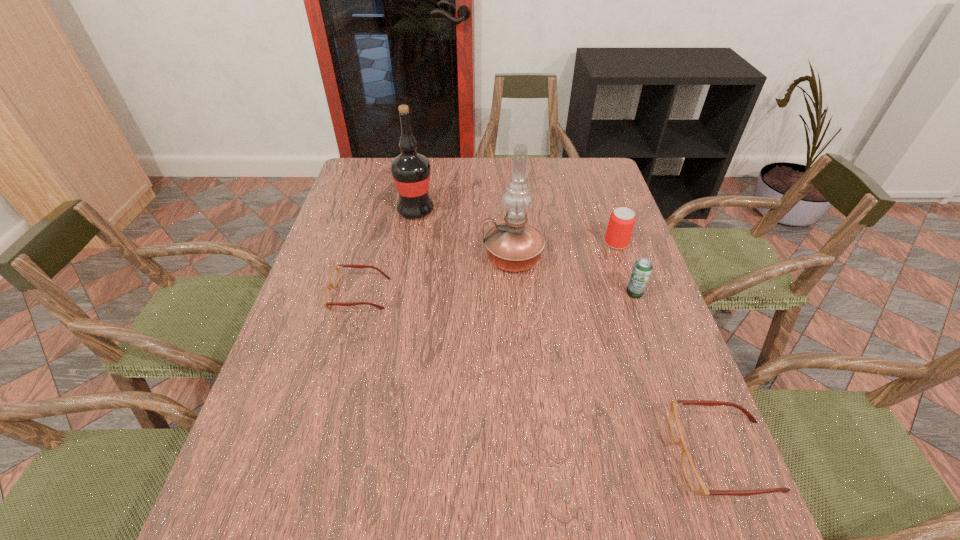
Locate an element on the screen. the left spectacles is located at coordinates (334, 276).

At what (x,y) coordinates should I click in order to perform the action: click on the shortest object. Please return your answer as a coordinate pair (x, y). This screenshot has height=540, width=960. Looking at the image, I should click on (334, 276).

The image size is (960, 540). I want to click on the taller spectacles, so click(694, 480).

This screenshot has width=960, height=540. I want to click on the nearest object, so click(694, 480).

At what (x,y) coordinates should I click in order to perform the action: click on wine bottle. Please return your answer as a coordinate pair (x, y). Image resolution: width=960 pixels, height=540 pixels. Looking at the image, I should click on (411, 170).

Where is `the nearer beer can`? This screenshot has width=960, height=540. the nearer beer can is located at coordinates (642, 269).

You are a GUI agent. You are given a task and a screenshot of the screen. Output one action in this format:
    pyautogui.click(x=<x>, y=<y>)
    Task: Click on the oil lamp
    The height and width of the screenshot is (540, 960).
    Given the screenshot: What is the action you would take?
    pyautogui.click(x=514, y=246)

Image resolution: width=960 pixels, height=540 pixels. Find the location of `the farther beer can`. the farther beer can is located at coordinates (622, 220).

Identify the location of vacant space located 0.100m on the front-facing side of the right spectacles. Image resolution: width=960 pixels, height=540 pixels. (622, 455).

The height and width of the screenshot is (540, 960). Identify the location of vacant area situated 0.300m on the front-facing side of the right spectacles. (517, 455).